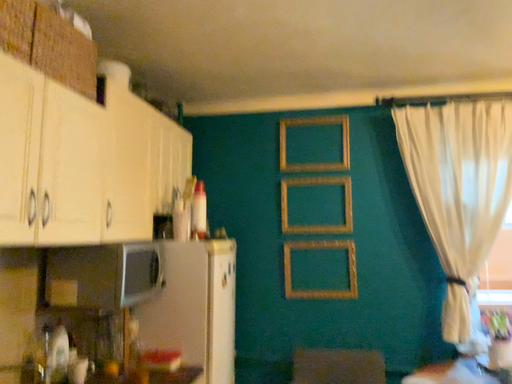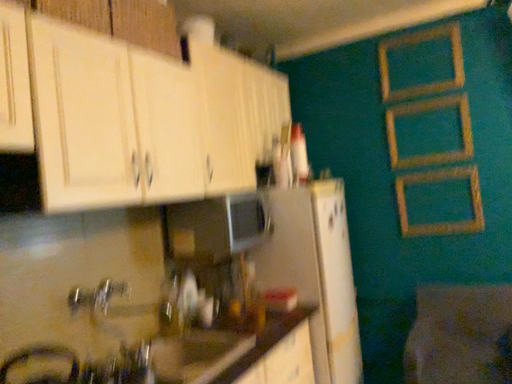
Question: Which way did the camera rotate in the video?

Choices:
 (A) rotated right
 (B) rotated left

Answer: (B)